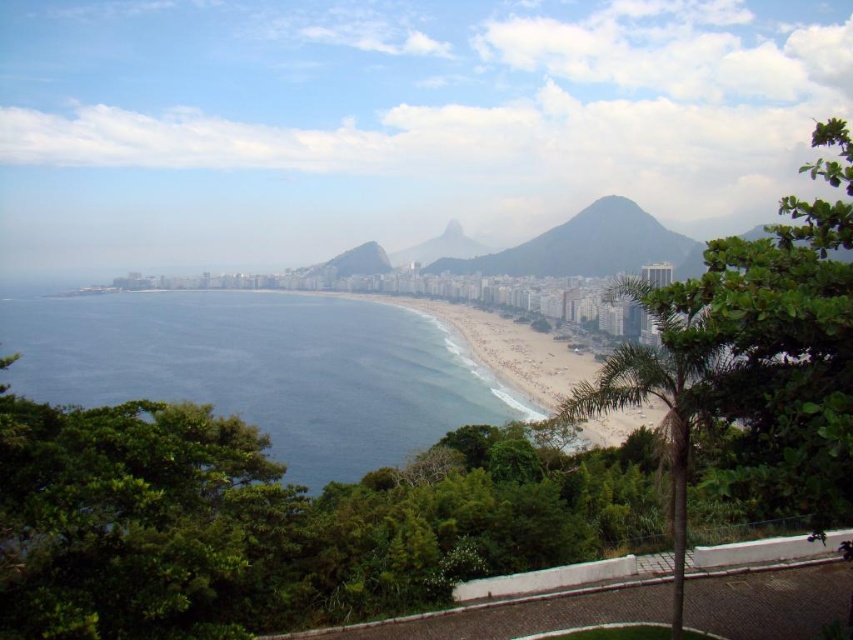
Identify the location of blue water at center. The width and height of the screenshot is (853, 640). (263, 369).

Looking at this image, can you confirm if blue water at center is bigger than green textured mountain at center?

Yes, blue water at center is bigger than green textured mountain at center.

You are a GUI agent. You are given a task and a screenshot of the screen. Output one action in this format:
    pyautogui.click(x=<x>, y=<y>)
    Task: Click on the blue water at center
    This screenshot has width=853, height=640.
    Given the screenshot: What is the action you would take?
    pyautogui.click(x=263, y=369)